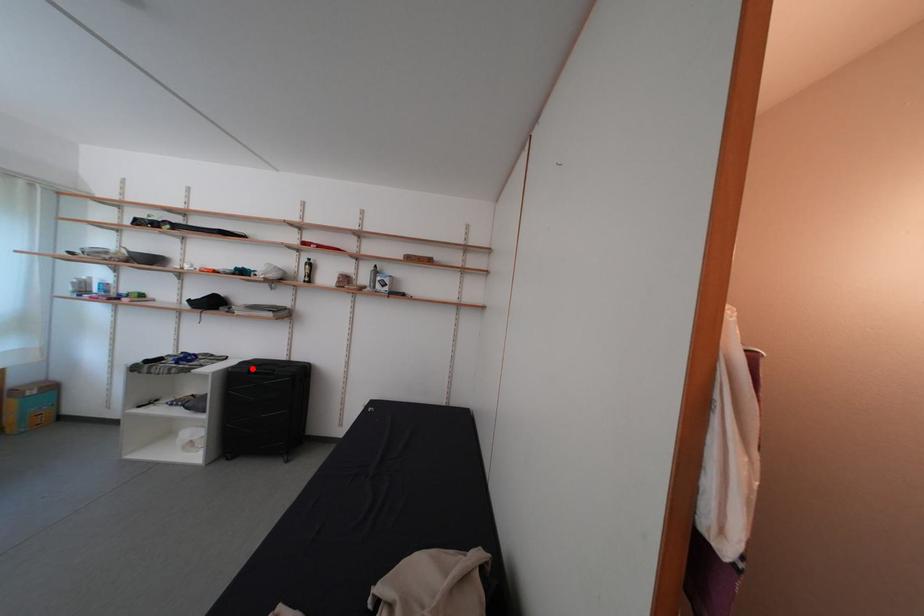
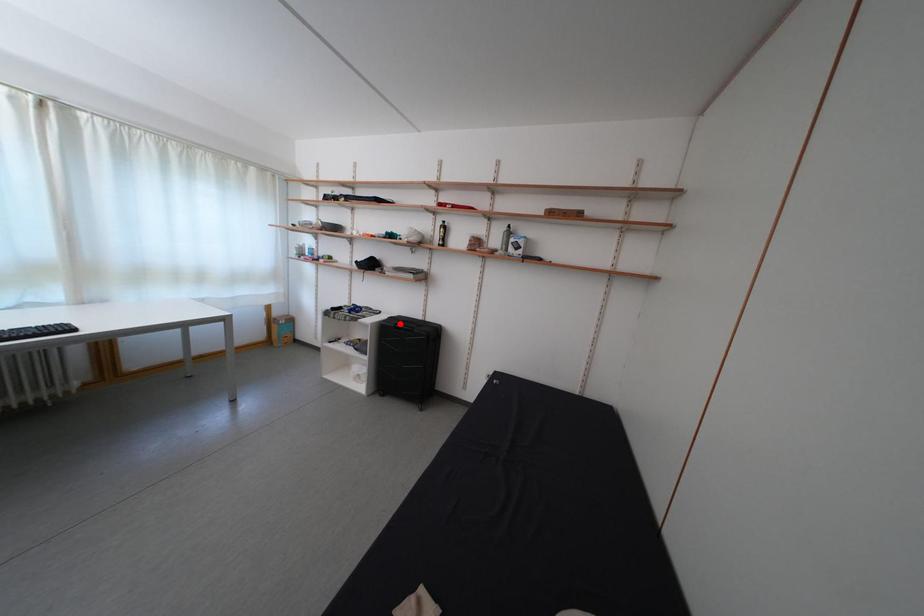
I am providing you with two images of the same scene from different viewpoints. A red point is marked on the first image and another point is marked on the second image. Does the point marked in image1 correspond to the same location as the one in image2?

Yes